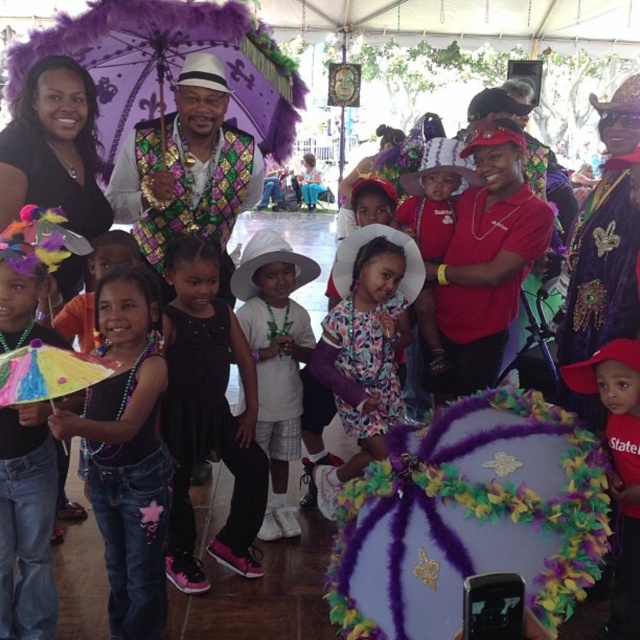
Which of these two, black satin dress at center or white matte shirt at center, stands shorter?

white matte shirt at center

Which is more to the left, black satin dress at center or white matte shirt at center?

Positioned to the left is black satin dress at center.

What do you see at coordinates (208, 413) in the screenshot? This screenshot has height=640, width=640. I see `black satin dress at center` at bounding box center [208, 413].

This screenshot has width=640, height=640. I want to click on black satin dress at center, so click(208, 413).

Does black satin dress at center lie in front of floral-patterned dress at center?

Yes.

Can you confirm if black satin dress at center is wider than floral-patterned dress at center?

No.

Who is more forward, (177, 582) or (355, 384)?

Positioned in front is point (177, 582).

The width and height of the screenshot is (640, 640). What are the coordinates of `black satin dress at center` in the screenshot? It's located at (208, 413).

Does floral-patterned dress at center lie behind red cotton shirt at lower right?

That is True.

Does floral-patterned dress at center have a greater height compared to red cotton shirt at lower right?

Yes, floral-patterned dress at center is taller than red cotton shirt at lower right.

What do you see at coordinates (362, 362) in the screenshot? Image resolution: width=640 pixels, height=640 pixels. I see `floral-patterned dress at center` at bounding box center [362, 362].

This screenshot has width=640, height=640. Identify the location of floral-patterned dress at center. (362, 362).